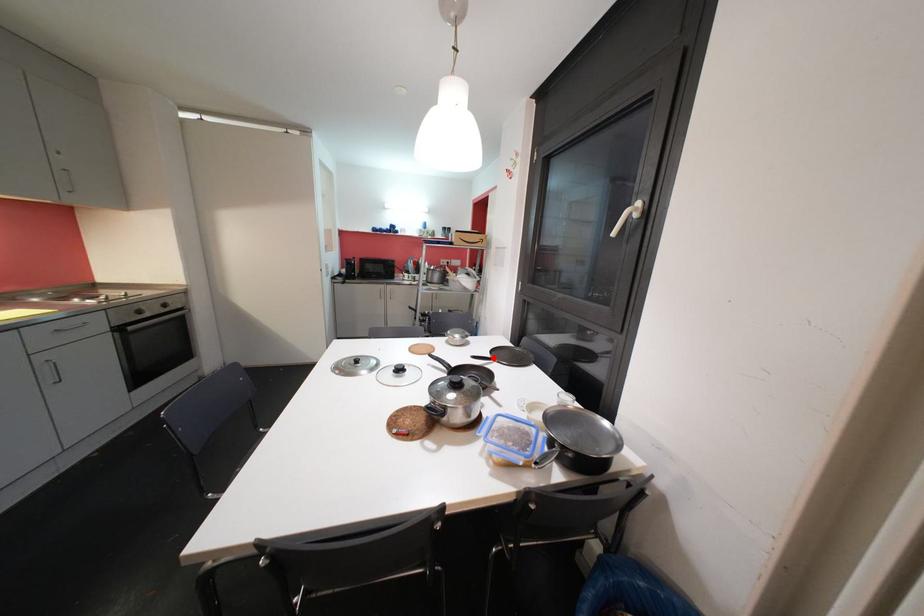
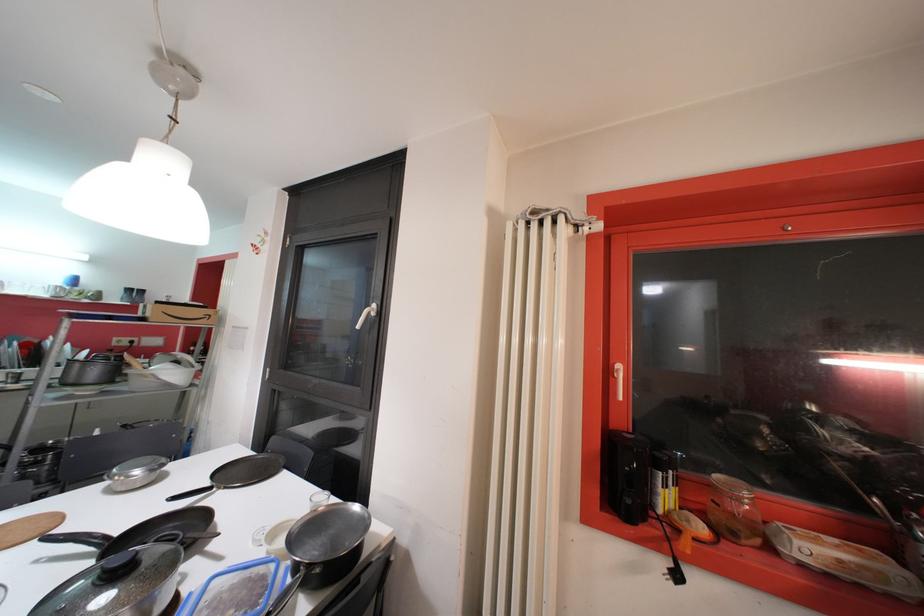
The point at the highlighted location is marked in the first image. Where is the corresponding point in the second image?

(213, 485)